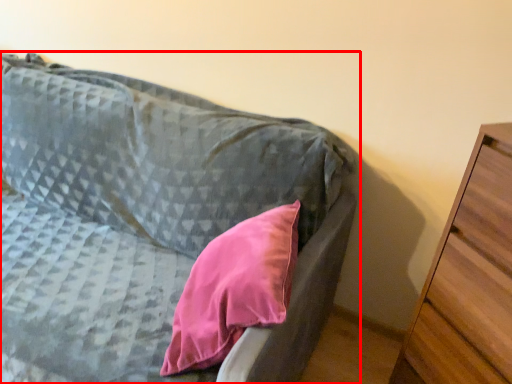
Question: In this image, where is furniture (annotated by the red box) located relative to chest of drawers?

Choices:
 (A) left
 (B) right

Answer: (A)